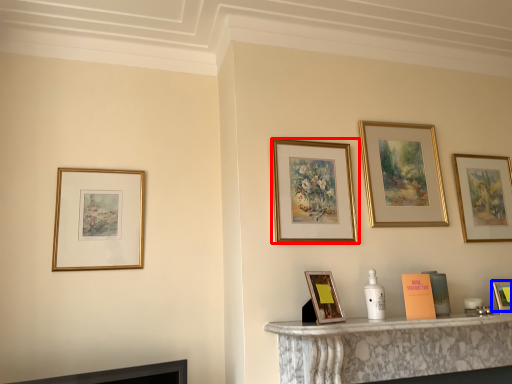
Question: Which object is further to the camera taking this photo, picture frame (highlighted by a red box) or picture frame (highlighted by a blue box)?

Choices:
 (A) picture frame
 (B) picture frame

Answer: (B)